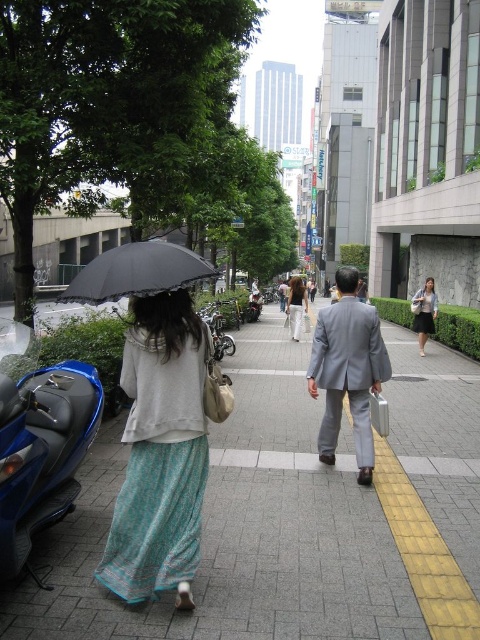
Can you confirm if gray concrete sidewalk at center is positioned to the right of blue metallic motorcycle at center?

Correct, you'll find gray concrete sidewalk at center to the right of blue metallic motorcycle at center.

This screenshot has height=640, width=480. What do you see at coordinates (297, 515) in the screenshot?
I see `gray concrete sidewalk at center` at bounding box center [297, 515].

At what (x,y) coordinates should I click in order to perform the action: click on gray concrete sidewalk at center. Please return your answer as a coordinate pair (x, y). Image resolution: width=480 pixels, height=640 pixels. Looking at the image, I should click on (297, 515).

In the scene shown: Between matte gray skirt at center and light brown fabric skirt at center, which one has more height?

With more height is light brown fabric skirt at center.

Is matte gray skirt at center shorter than light brown fabric skirt at center?

Indeed, matte gray skirt at center has a lesser height compared to light brown fabric skirt at center.

Which is behind, point (411, 310) or point (300, 298)?

Point (300, 298)

Identify the location of matte gray skirt at center. This screenshot has width=480, height=640. (423, 312).

Which is more to the right, light blue textured skirt at left or gray suit at center?

gray suit at center

Find the location of a particular element. light blue textured skirt at left is located at coordinates (160, 452).